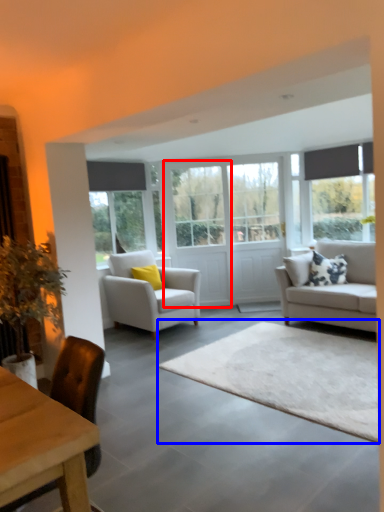
Question: Among these objects, which one is nearest to the camera, glass door (highlighted by a red box) or plain (highlighted by a blue box)?

Choices:
 (A) glass door
 (B) plain

Answer: (B)